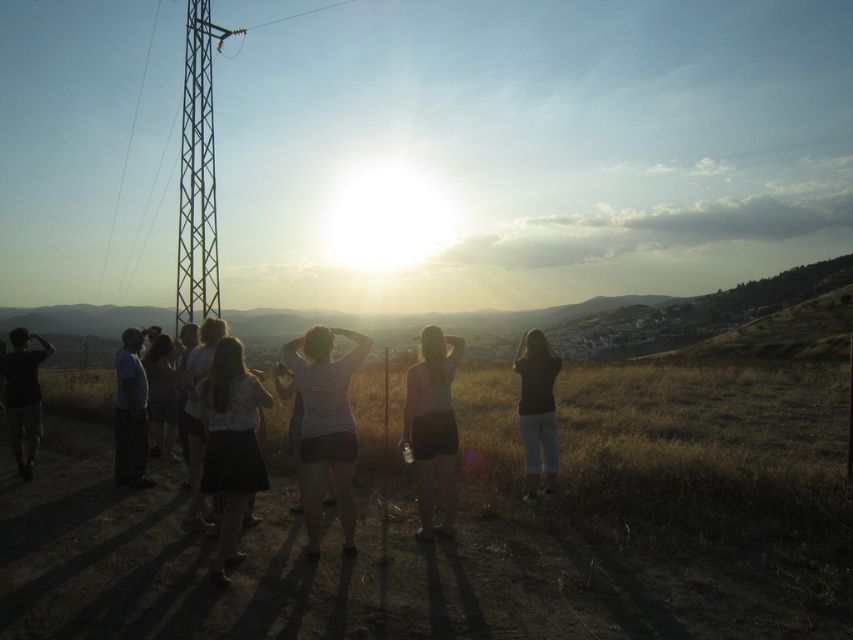
Question: Observing the image, what is the correct spatial positioning of metallic wire at left in reference to metallic wire at upper center?

Choices:
 (A) below
 (B) above

Answer: (A)

Question: Which point is farther from the camera taking this photo?

Choices:
 (A) (427, 540)
 (B) (115, 464)
 (C) (128, 600)

Answer: (B)

Question: In this image, where is grassy hill at center located relative to black cotton shirt at right?

Choices:
 (A) right
 (B) left

Answer: (A)

Question: Among these objects, which one is nearest to the camera?

Choices:
 (A) white striped shirt at center
 (B) black matte skirt at lower left

Answer: (B)

Question: Is metallic grid tower at left positioned in front of black cotton shirt at right?

Choices:
 (A) yes
 (B) no

Answer: (B)

Question: Which object is closer to the camera taking this photo?

Choices:
 (A) black matte skirt at lower left
 (B) metallic grid tower at left

Answer: (A)